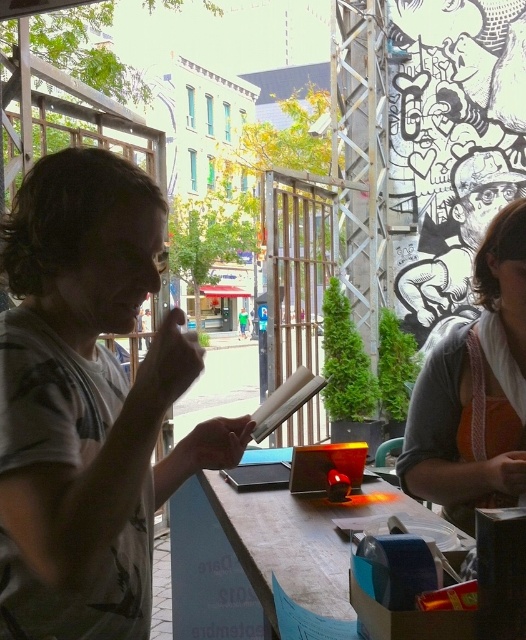
Question: Can you confirm if orange fabric apron at right is wider than wooden table at center?

Choices:
 (A) yes
 (B) no

Answer: (B)

Question: Which point appears farthest from the camera in this image?

Choices:
 (A) (153, 497)
 (B) (216, 605)

Answer: (B)

Question: In this image, where is orange fabric apron at right located relative to wooden table at center?

Choices:
 (A) right
 (B) left

Answer: (A)

Question: Estimate the real-world distances between objects in this image. Which object is closer to the orange fabric apron at right?

Choices:
 (A) wooden table at center
 (B) light brown t-shirt at left

Answer: (A)

Question: Which object is the farthest from the light brown t-shirt at left?

Choices:
 (A) orange fabric apron at right
 (B) wooden table at center

Answer: (A)

Question: Observing the image, what is the correct spatial positioning of orange fabric apron at right in reference to wooden table at center?

Choices:
 (A) above
 (B) below

Answer: (A)